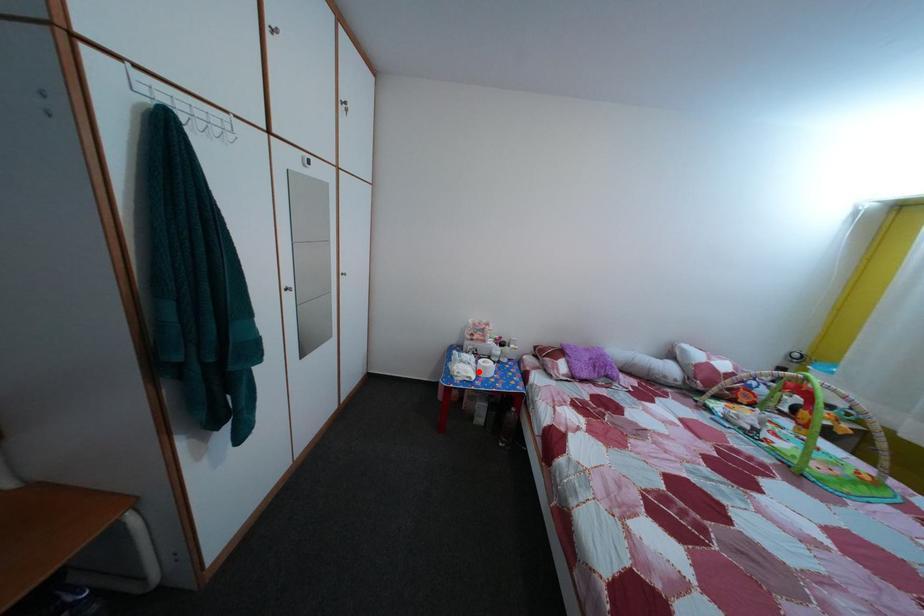
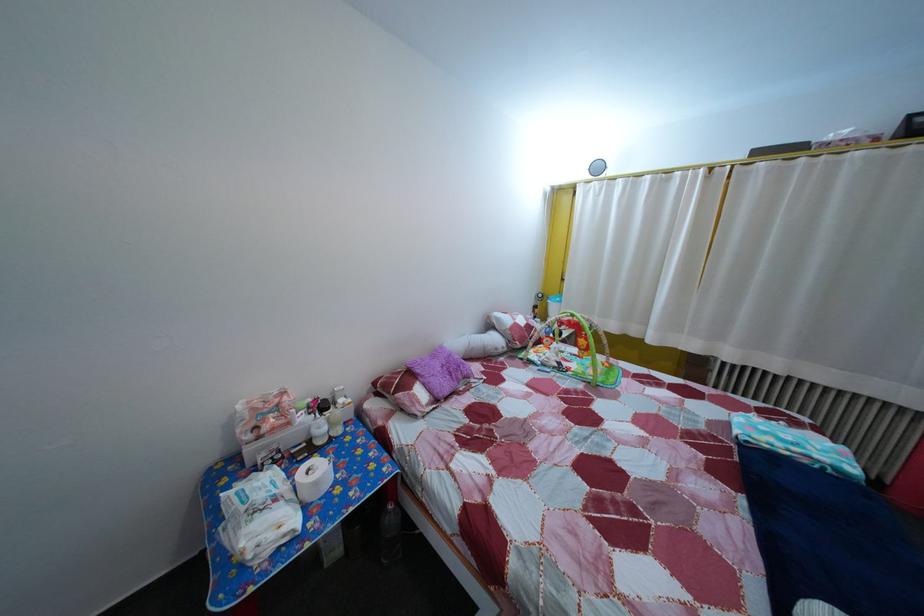
Question: I am providing you with two images of the same scene from different viewpoints. A red point is shown in image1. For the corresponding object point in image2, is it positioned nearer or farther from the camera?

Choices:
 (A) Nearer
 (B) Farther

Answer: (A)